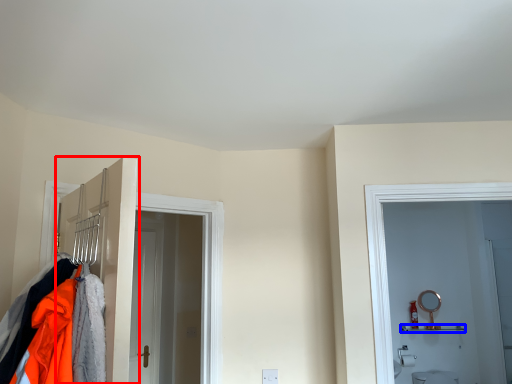
Question: Which point is closer to the camera, door (highlighted by a red box) or shelf (highlighted by a blue box)?

Choices:
 (A) door
 (B) shelf

Answer: (A)